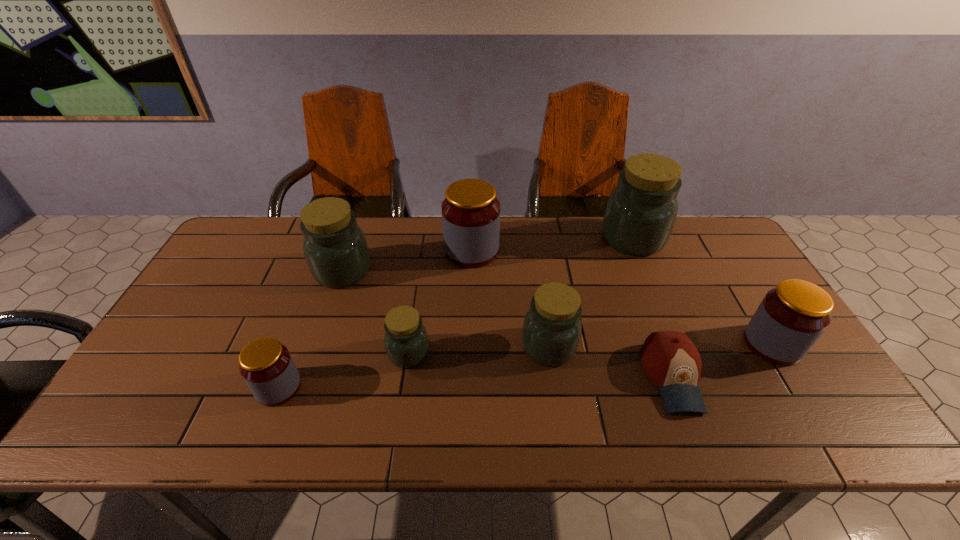
Identify the location of vacant area located 0.300m on the back of the smallest red jar. (318, 285).

This screenshot has height=540, width=960. Identify the location of vacant space located on the left of the smallest green jar. pyautogui.click(x=321, y=353).

This screenshot has height=540, width=960. Identify the location of jar that is at the near edge. (265, 364).

At what (x,y) coordinates should I click in order to perform the action: click on baseball cap that is positioned at the near edge. Please return your answer as a coordinate pair (x, y). The image size is (960, 540). Looking at the image, I should click on (670, 359).

Image resolution: width=960 pixels, height=540 pixels. What are the coordinates of `object that is positioned at the right edge` in the screenshot? It's located at (791, 317).

The height and width of the screenshot is (540, 960). In order to click on blank area at the far edge in this screenshot , I will do `click(411, 245)`.

In order to click on vacant space at the near edge of the desktop in this screenshot , I will do `click(668, 435)`.

Where is `vacant space at the left edge of the desktop`? The image size is (960, 540). vacant space at the left edge of the desktop is located at coordinates (189, 354).

Find the location of a particular element. The width and height of the screenshot is (960, 540). vacant point located between the shortest object and the third green jar from right to left is located at coordinates (540, 365).

Locate an element on the screen. The image size is (960, 540). empty location between the third jar from left to right and the smallest red jar is located at coordinates tap(344, 370).